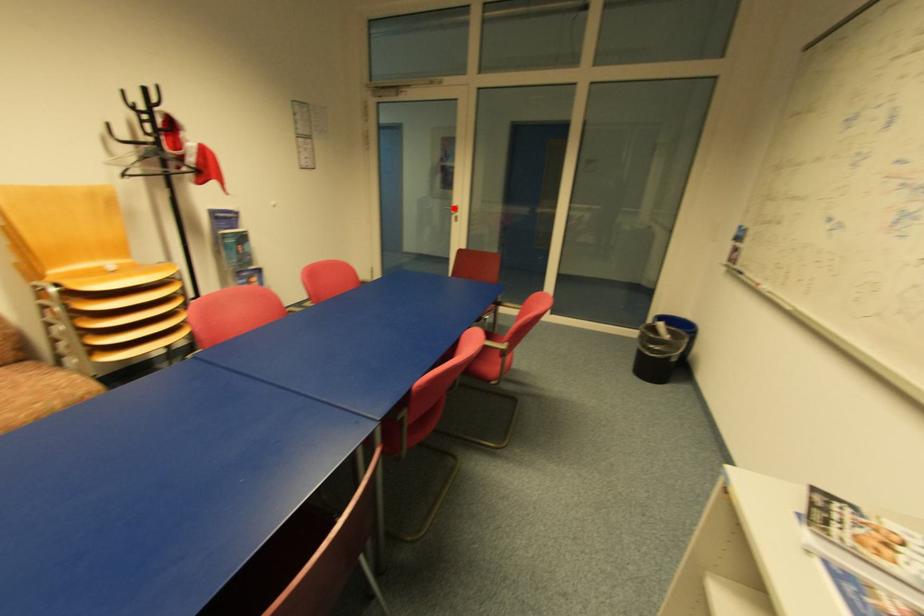
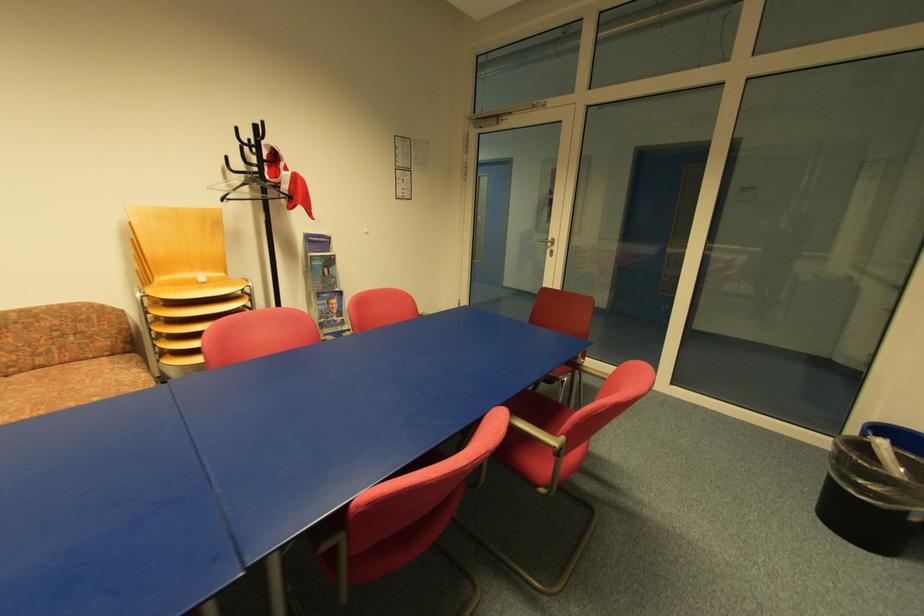
Question: A red point is marked in image1. In image2, is the corresponding 3D point closer to the camera or farther? Reply with the corresponding letter.

Choices:
 (A) The corresponding 3D point is closer.
 (B) The corresponding 3D point is farther.

Answer: (B)